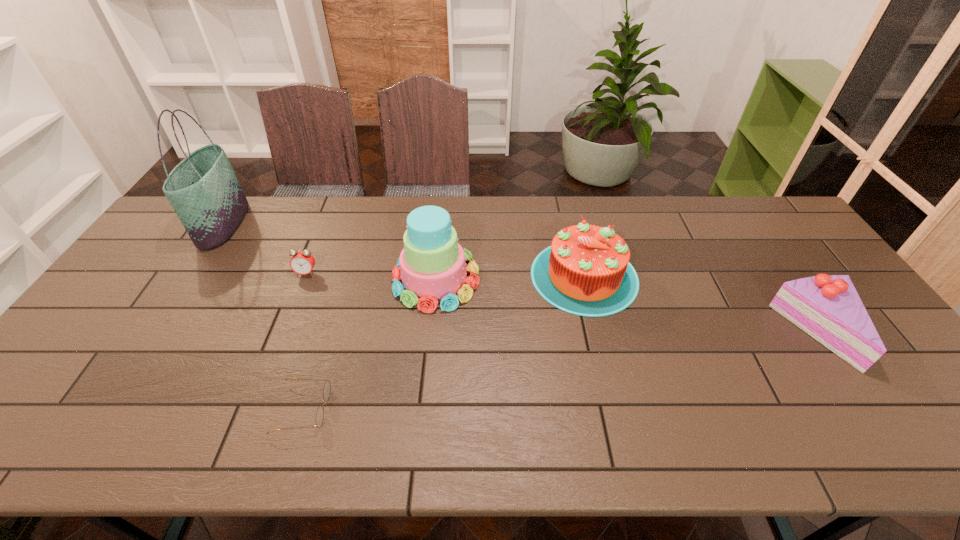
Where is `object that is at the left edge`? The height and width of the screenshot is (540, 960). object that is at the left edge is located at coordinates (203, 189).

At what (x,y) coordinates should I click in order to perform the action: click on object positioned at the right edge. Please return your answer as a coordinate pair (x, y). Looking at the image, I should click on (827, 307).

Locate an element on the screen. The height and width of the screenshot is (540, 960). object positioned at the far left corner is located at coordinates (203, 189).

You are a GUI agent. You are given a task and a screenshot of the screen. Output one action in this format:
    pyautogui.click(x=<x>, y=<y>)
    Task: Click on the free region at the far edge of the desktop
    
    Given the screenshot: What is the action you would take?
    (x=646, y=238)

Find the location of a particular element. The width and height of the screenshot is (960, 540). free space at the near edge is located at coordinates (413, 427).

At what (x,y) coordinates should I click in order to perform the action: click on vacant space at the left edge of the desktop. Please return your answer as a coordinate pair (x, y). This screenshot has width=960, height=540. Looking at the image, I should click on (150, 249).

At what (x,y) coordinates should I click in order to perform the action: click on blank area at the right edge. Please return your answer as a coordinate pair (x, y). Looking at the image, I should click on (808, 258).

At what (x,y) coordinates should I click in order to perform the action: click on free space that is in between the leftmost cake and the nearest object. Please return your answer as a coordinate pair (x, y). Looking at the image, I should click on (370, 344).

Image resolution: width=960 pixels, height=540 pixels. Find the location of `free space that is in between the second shortest object and the second tallest object`. free space that is in between the second shortest object and the second tallest object is located at coordinates (372, 276).

At what (x,y) coordinates should I click in order to perform the action: click on vacant region between the second object from left to right and the spectacles. Please return your answer as a coordinate pair (x, y). The image size is (960, 540). Looking at the image, I should click on (305, 341).